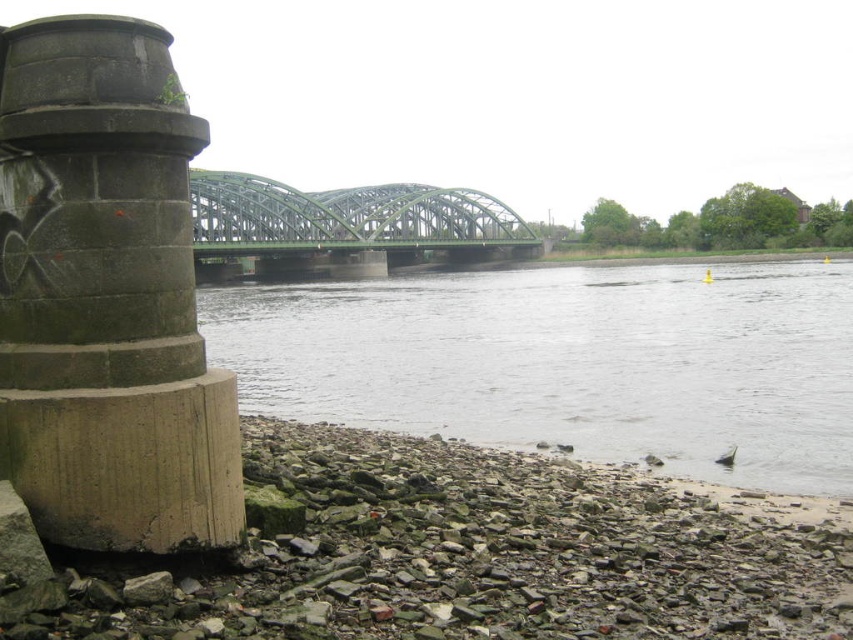
You are standing on the concrete structure on the left and want to walk to the gray gravel river at lower center. Which direction should you move relative to the rough stone river bank at lower left?

You should move away from the rough stone river bank at lower left because the rough stone river bank at lower left is below the gray gravel river at lower center, so moving away from it would lead you upward towards the gray gravel river at lower center.

Looking at this image, you are a photographer planning to capture the entire green metallic bridge at center and the rough stone river bank at lower left in a single frame. Given their relative widths, which object should you position closer to the edge of the frame to ensure both fit?

The rough stone river bank at lower left is thinner than the green metallic bridge at center, so you should position the rough stone river bank at lower left closer to the edge of the frame to ensure both fit.

You are standing at the riverside and want to cross to the other side. You see the rough stone river bank at lower left and the gray gravel river at lower center. Which path should you take to reach the water first?

The rough stone river bank at lower left is in front of the gray gravel river at lower center, so you should take the rough stone river bank at lower left to reach the water first.